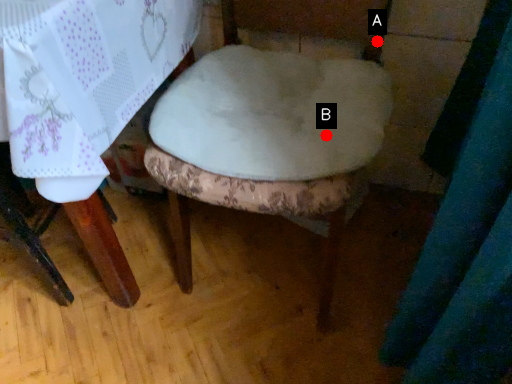
Question: Two points are circled on the image, labeled by A and B beside each circle. Which of the following is the closest to the observer?

Choices:
 (A) A is closer
 (B) B is closer

Answer: (B)